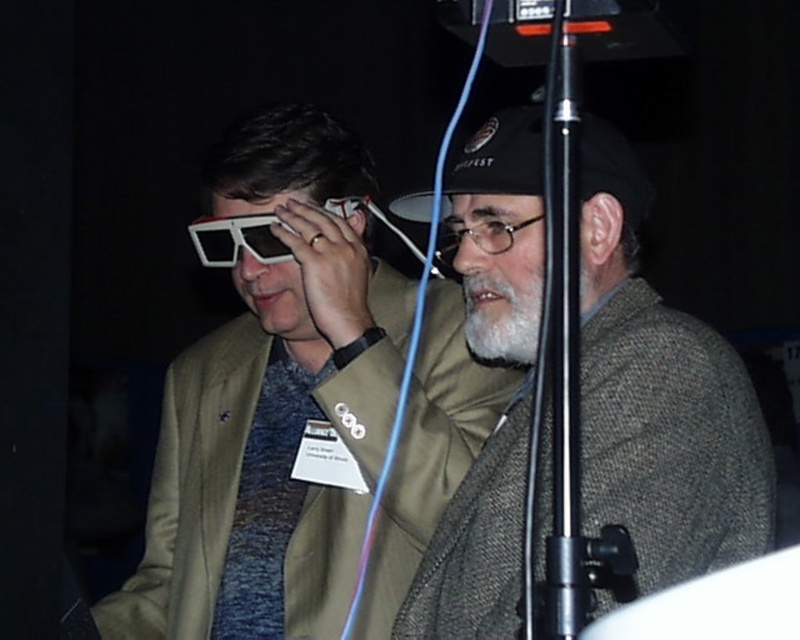
You are standing in the room where the two people are. You want to place a small plant between the two points, point (262,252) and point (380,212). Which point should the plant be closer to so it is in front of the other point?

The plant should be placed closer to point (262,252) because it is in front of point (380,212).

You are a photographer setting up for a photo shoot. You need to position a white plastic goggles at center and a black matte microphone at center such that the microphone is to the right of the goggles. Is the current arrangement correct?

The white plastic goggles at center is positioned on the left side of black matte microphone at center, so the current arrangement already has the microphone to the right of the goggles, which matches your requirement.